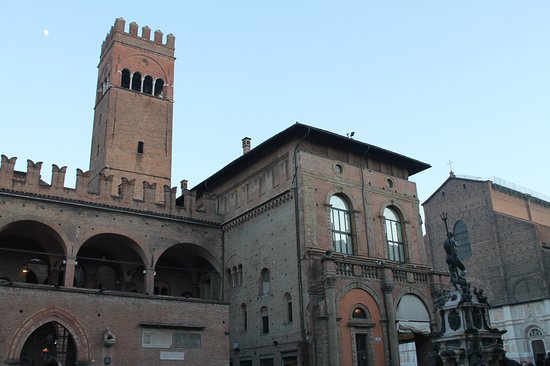
Locate an element on the screen. window is located at coordinates (397, 235), (338, 222), (456, 233).